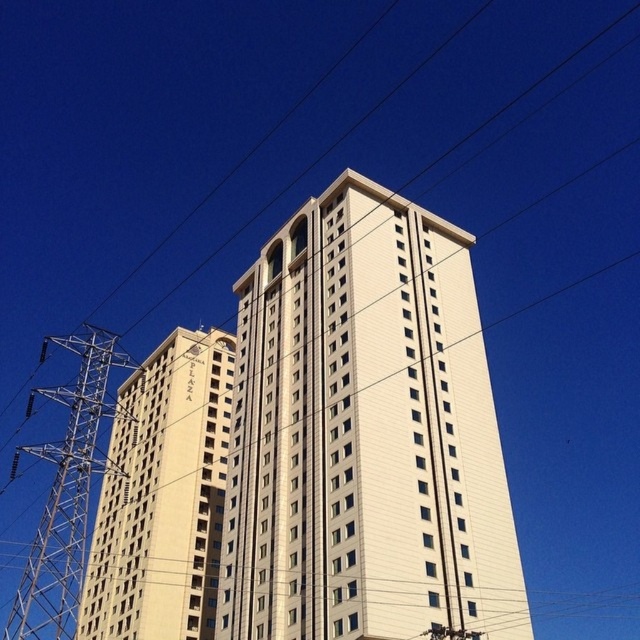
Describe the element at coordinates (163, 496) in the screenshot. I see `beige stone building at left` at that location.

From the picture: Who is shorter, beige stone building at left or metallic silver tower at left?

With less height is beige stone building at left.

Image resolution: width=640 pixels, height=640 pixels. What do you see at coordinates (163, 496) in the screenshot?
I see `beige stone building at left` at bounding box center [163, 496].

In order to click on beige stone building at left in this screenshot , I will do `click(163, 496)`.

Between point (262, 305) and point (221, 417), which one is positioned in front?

Point (262, 305) is more forward.

Who is shorter, white smooth building at center or beige stone building at left?

beige stone building at left is shorter.

Which is behind, point (371, 616) or point (216, 577)?

The point (216, 577) is more distant.

Where is `white smooth building at center`? The width and height of the screenshot is (640, 640). white smooth building at center is located at coordinates (364, 435).

Can you confirm if white smooth building at center is thinner than metallic silver tower at left?

Correct, white smooth building at center's width is less than metallic silver tower at left's.

Is white smooth building at center to the left of metallic silver tower at left from the viewer's perspective?

Incorrect, white smooth building at center is not on the left side of metallic silver tower at left.

Where is `white smooth building at center`? The height and width of the screenshot is (640, 640). white smooth building at center is located at coordinates (364, 435).